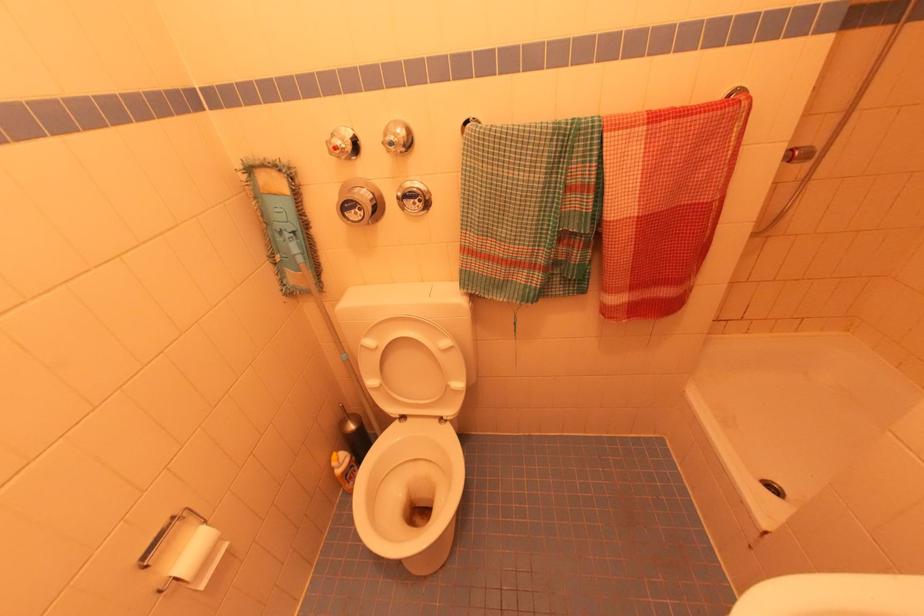
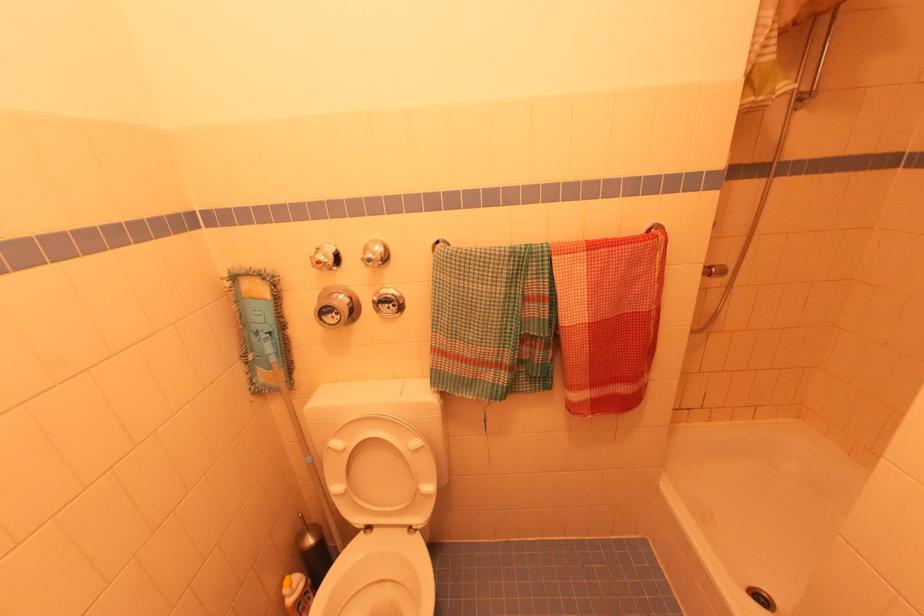
Where in the second image is the point corresponding to (x=345, y=142) from the first image?

(327, 257)